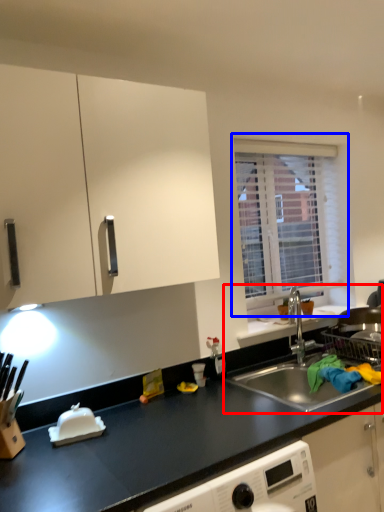
Question: Which point is further to the camera, sink (highlighted by a red box) or window (highlighted by a blue box)?

Choices:
 (A) sink
 (B) window

Answer: (B)